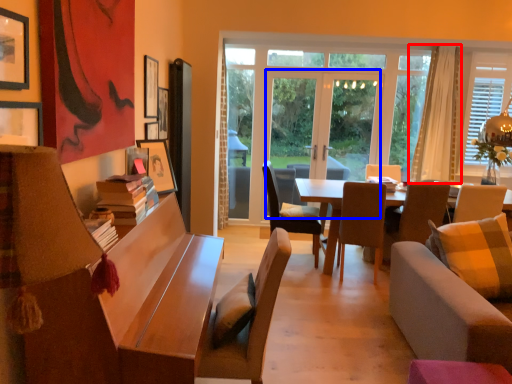
Question: Among these objects, which one is nearest to the camera, curtain (highlighted by a red box) or screen door (highlighted by a blue box)?

Choices:
 (A) curtain
 (B) screen door

Answer: (A)